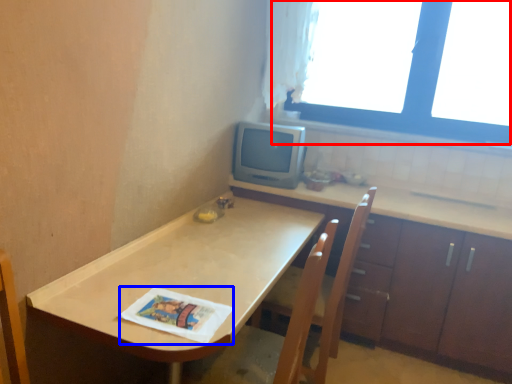
Question: Which of the following is the closest to the observer, window (highlighted by a red box) or magazine (highlighted by a blue box)?

Choices:
 (A) window
 (B) magazine

Answer: (B)